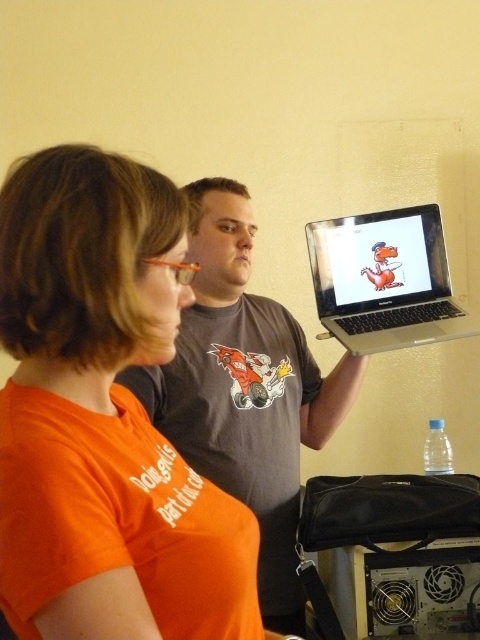
Question: Can you confirm if orange matte shirt at upper left is positioned below silver metallic laptop at upper right?

Choices:
 (A) no
 (B) yes

Answer: (B)

Question: Which point is farther to the camera?

Choices:
 (A) (231, 284)
 (B) (35, 632)
 (C) (367, 257)

Answer: (C)

Question: Among these points, which one is nearest to the camera?

Choices:
 (A) (323, 310)
 (B) (191, 390)
 (C) (72, 572)

Answer: (C)

Question: Can you confirm if orange matte shirt at upper left is positioned to the left of gray matte shirt at center?

Choices:
 (A) yes
 (B) no

Answer: (A)

Question: Which point is farther to the camera?

Choices:
 (A) gray matte shirt at center
 (B) orange matte shirt at upper left

Answer: (A)

Question: Can you confirm if gray matte shirt at center is positioned below silver metallic laptop at upper right?

Choices:
 (A) no
 (B) yes

Answer: (B)